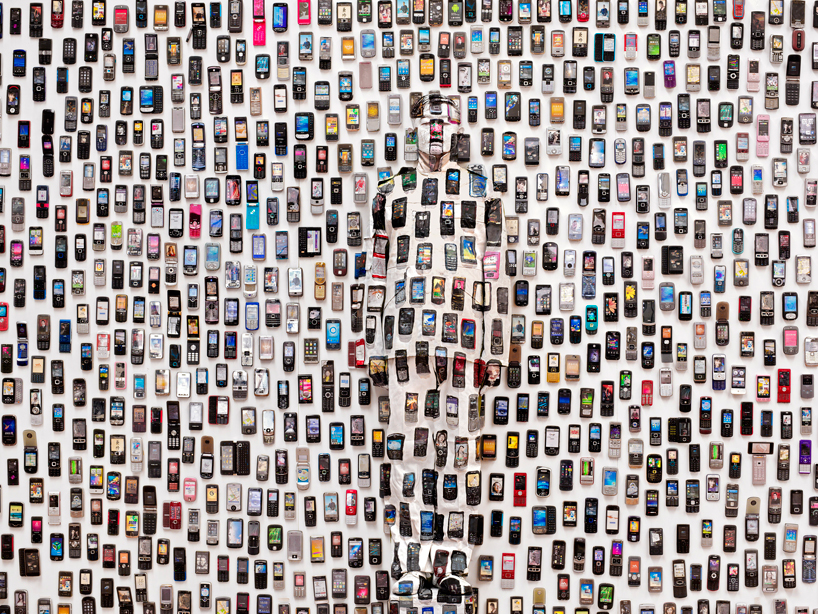
Identify the location of phone. This screenshot has height=614, width=818. (600, 569).